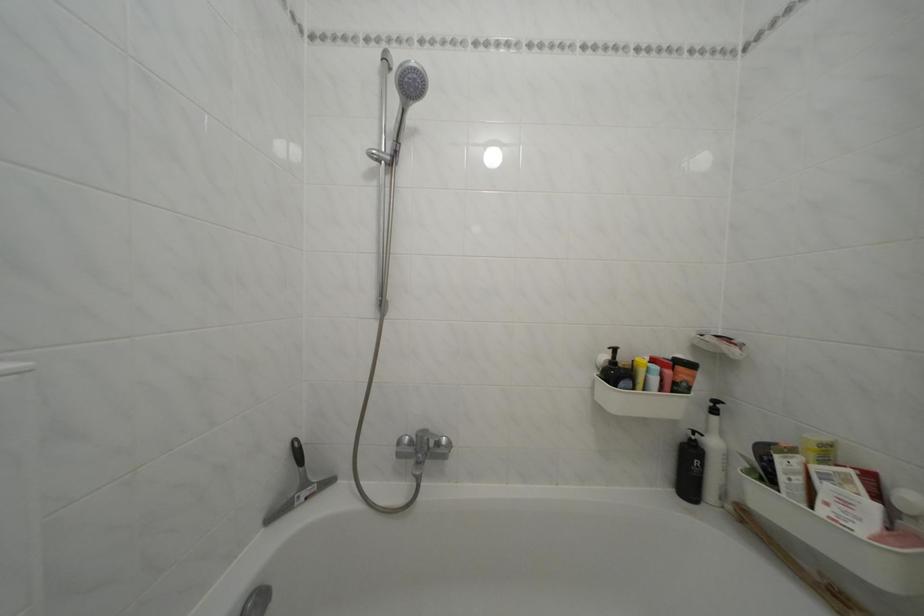
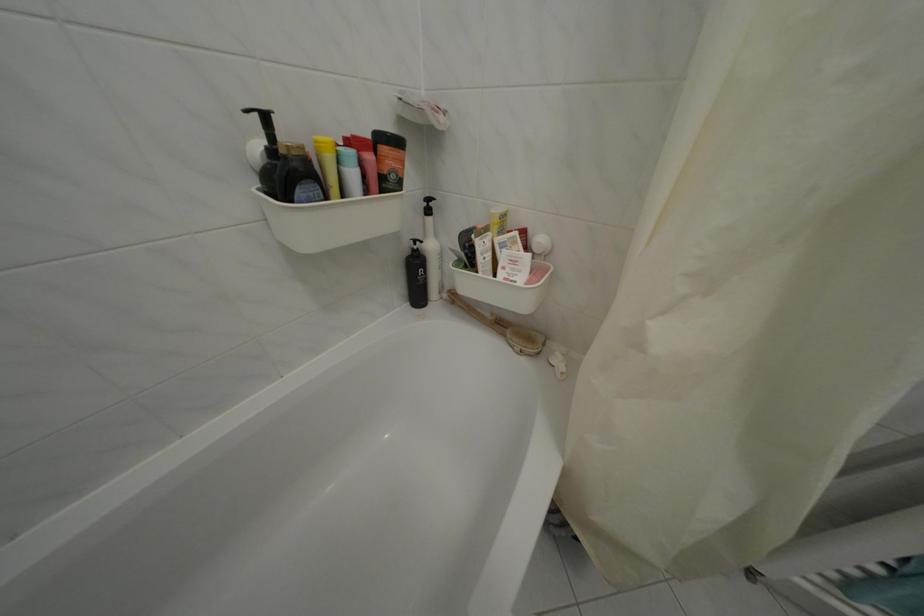
The point at (699, 459) is marked in the first image. Where is the corresponding point in the second image?

(424, 269)